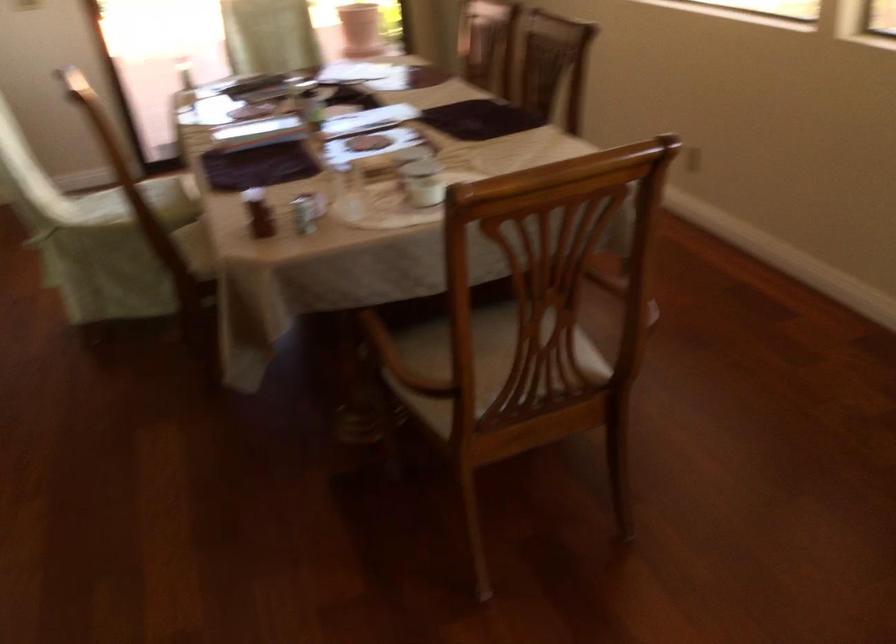
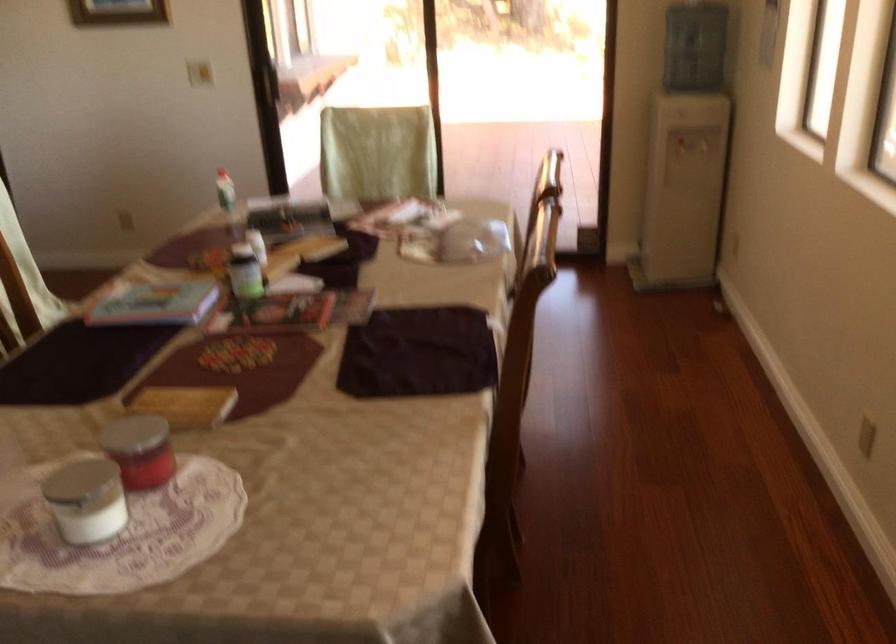
Where in the second image is the point corresponding to point 416,166 from the first image?

(149, 458)